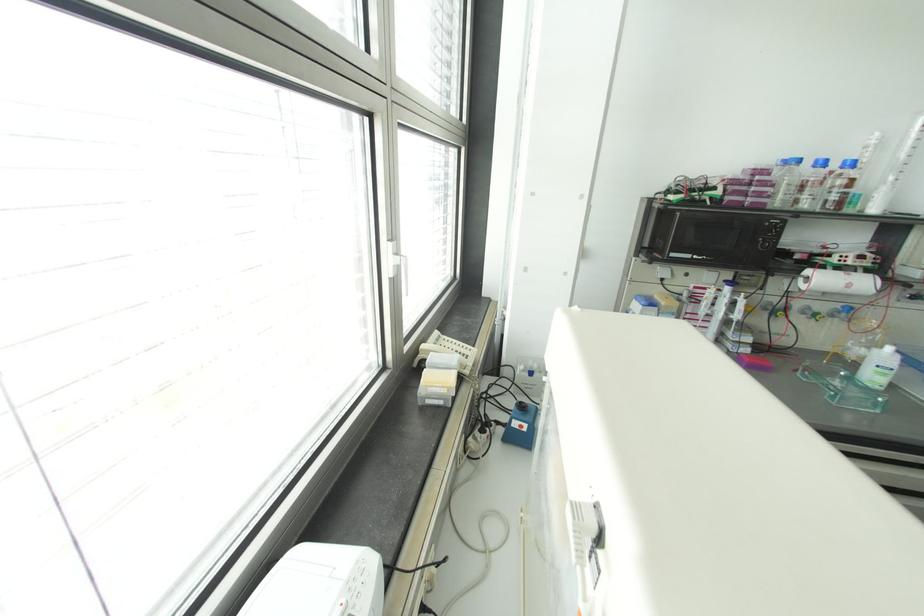
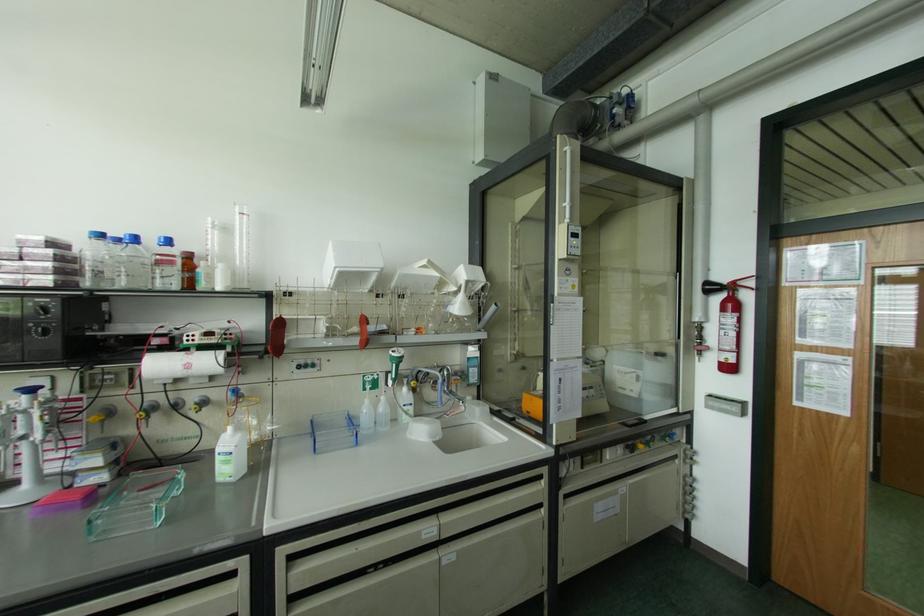
In the second image, find the point that corresponds to point (848, 285) in the first image.

(188, 366)